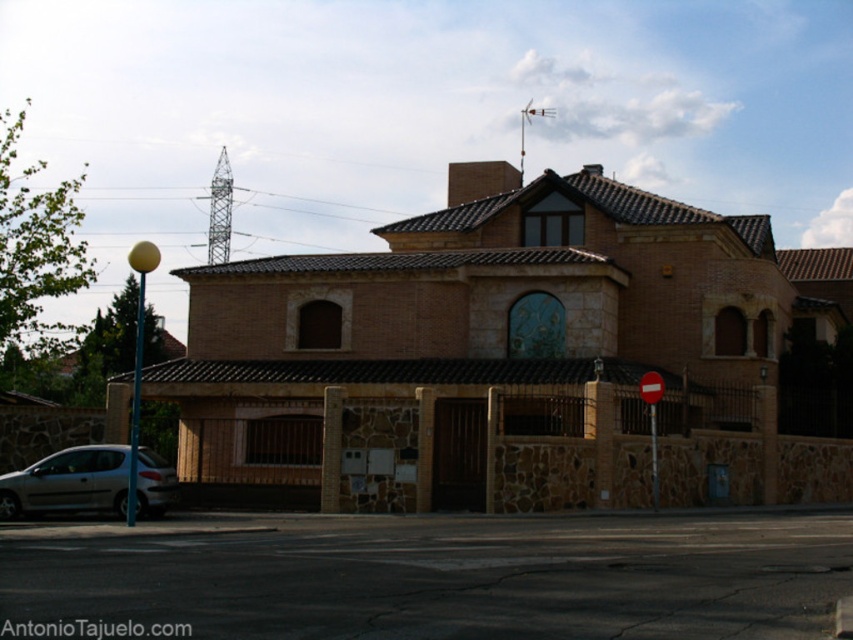
Can you confirm if silver metallic car at lower left is bigger than red plastic stop sign at center?

Correct, silver metallic car at lower left is larger in size than red plastic stop sign at center.

Measure the distance between point (149, 512) and camera.

Point (149, 512) is 85.46 feet away from camera.

The width and height of the screenshot is (853, 640). In order to click on silver metallic car at lower left in this screenshot , I will do `click(68, 483)`.